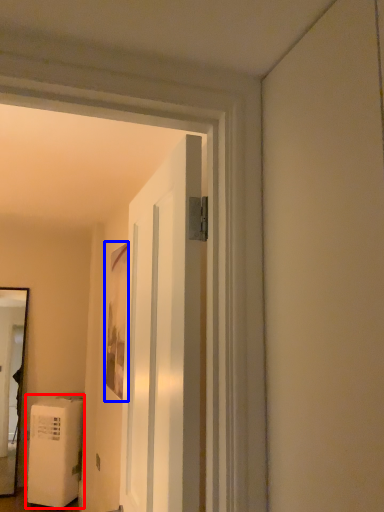
Question: Which object is further to the camera taking this photo, water heater (highlighted by a red box) or picture frame (highlighted by a blue box)?

Choices:
 (A) water heater
 (B) picture frame

Answer: (A)